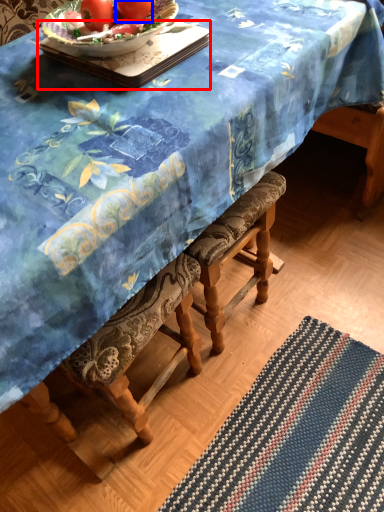
Question: Which point is closer to the camera, tray (highlighted by a red box) or tomato (highlighted by a blue box)?

Choices:
 (A) tray
 (B) tomato

Answer: (A)